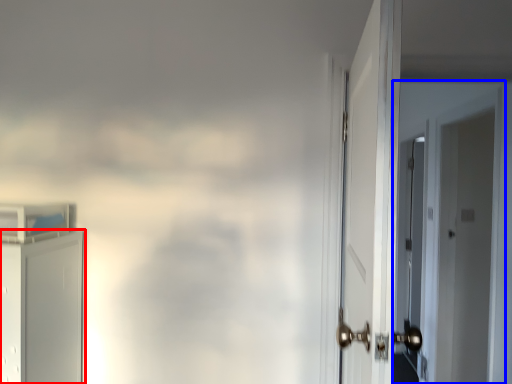
Question: Which object is closer to the camera taking this photo, door (highlighted by a red box) or door (highlighted by a blue box)?

Choices:
 (A) door
 (B) door

Answer: (A)